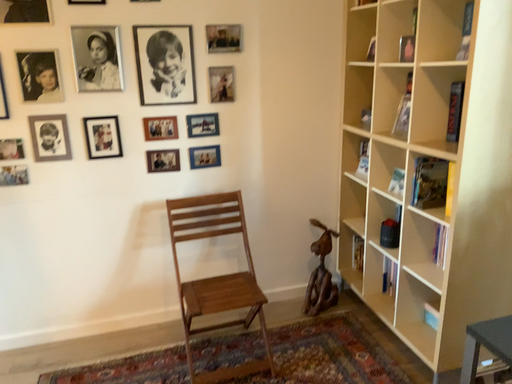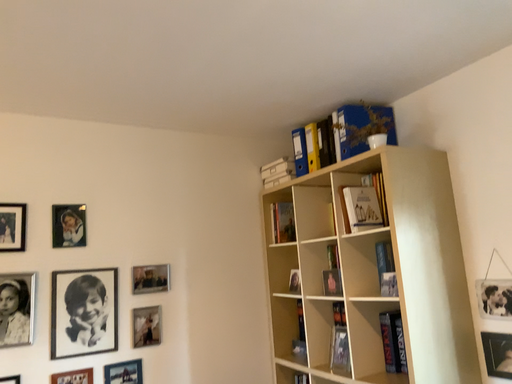
Question: Which way did the camera rotate in the video?

Choices:
 (A) rotated right
 (B) rotated left

Answer: (A)